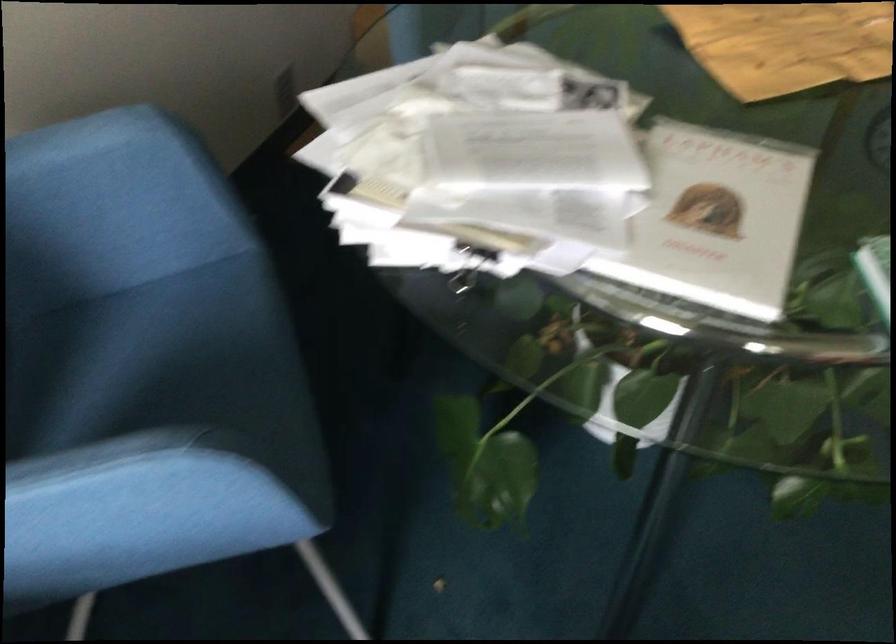
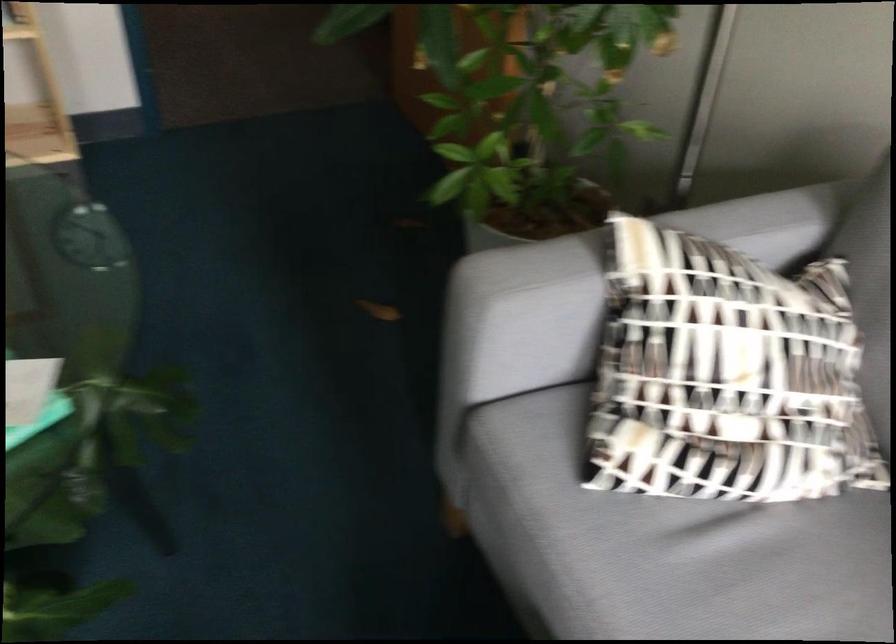
Question: Based on the continuous images, in which direction is the camera rotating? Reply with the corresponding letter.

Choices:
 (A) Left
 (B) Right
 (C) Up
 (D) Down

Answer: (B)